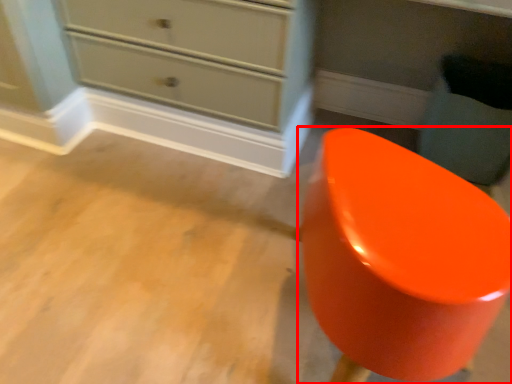
Question: From the image's perspective, where is furniture (annotated by the red box) located in relation to swivel chair in the image?

Choices:
 (A) below
 (B) above

Answer: (A)